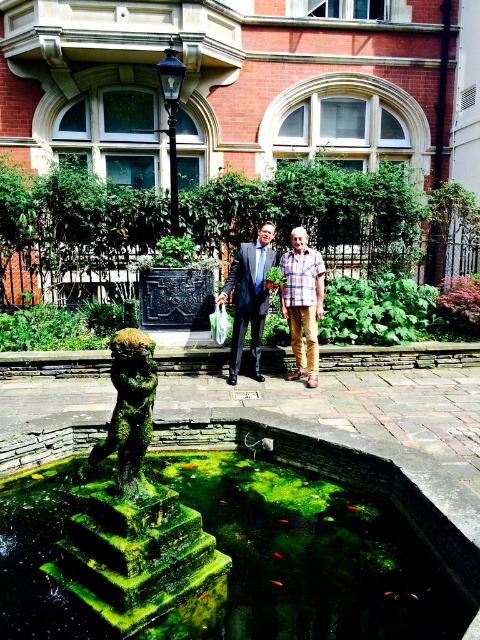
You are a landscape architect designing a pathway between the green mossy stone at center and the black metal lamp post at upper center. Which object should you place the starting point closer to if you want the pathway to slope downward as it approaches the shorter object?

The green mossy stone at center is shorter than the black metal lamp post at upper center. Therefore, you should place the starting point closer to the black metal lamp post at upper center so that the pathway slopes downward toward the shorter green mossy stone at center.

You are a photographer trying to capture a clear shot of the plaid fabric shirt at center and the black metal lamp post at upper center. Can you see both objects in the same frame without any obstruction?

Yes, the plaid fabric shirt at center is in front of the black metal lamp post at upper center, so both can be seen in the same frame with the shirt slightly overlapping the lamp post.